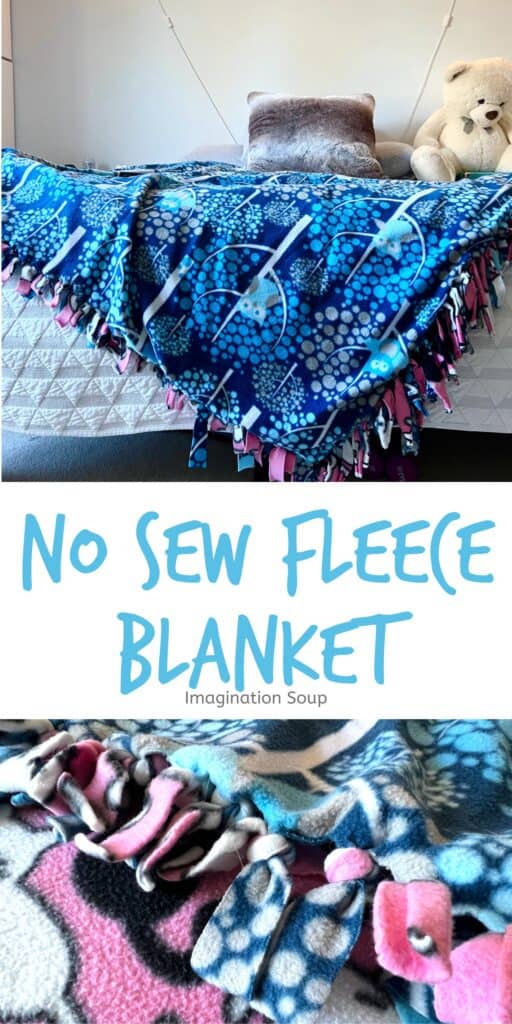
Image resolution: width=512 pixels, height=1024 pixels. I want to click on teddy bear, so click(473, 133).